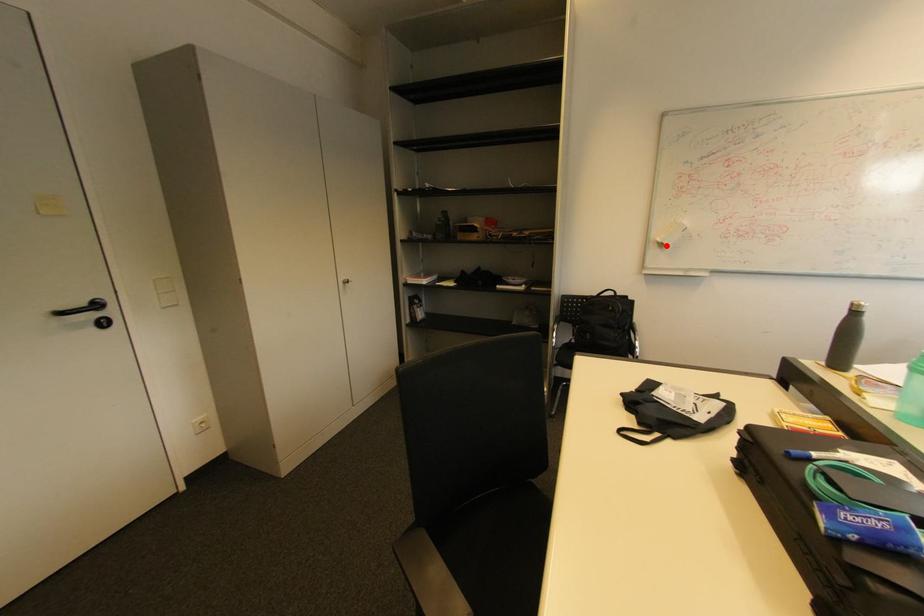
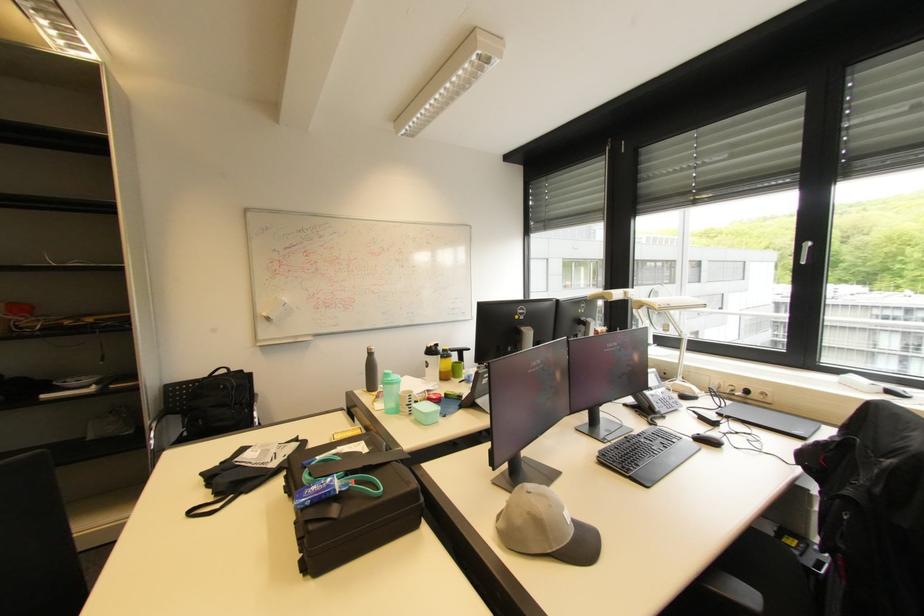
Question: A red point is marked in image1. In image2, is the corresponding 3D point closer to the camera or farther? Reply with the corresponding letter.

Choices:
 (A) The corresponding 3D point is closer.
 (B) The corresponding 3D point is farther.

Answer: (B)